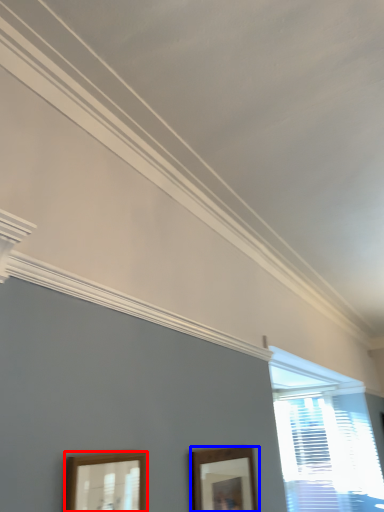
Question: Which of the following is the farthest to the observer, picture frame (highlighted by a red box) or picture frame (highlighted by a blue box)?

Choices:
 (A) picture frame
 (B) picture frame

Answer: (B)